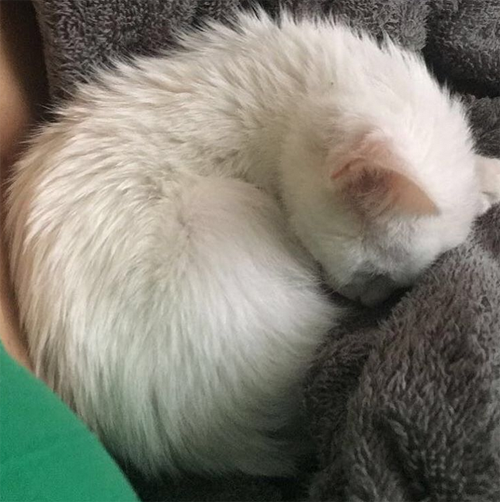
This screenshot has width=500, height=502. Identify the location of white fur. (219, 268).